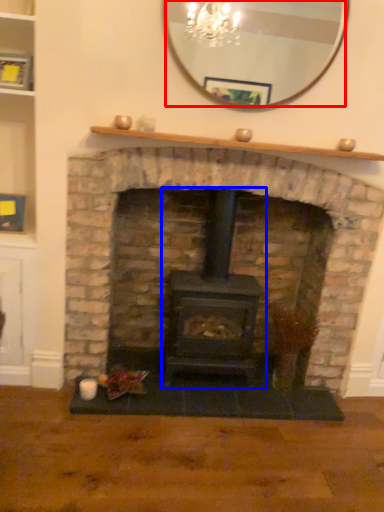
Question: Which point is further to the camera, mirror (highlighted by a red box) or wood burning stove (highlighted by a blue box)?

Choices:
 (A) mirror
 (B) wood burning stove

Answer: (B)